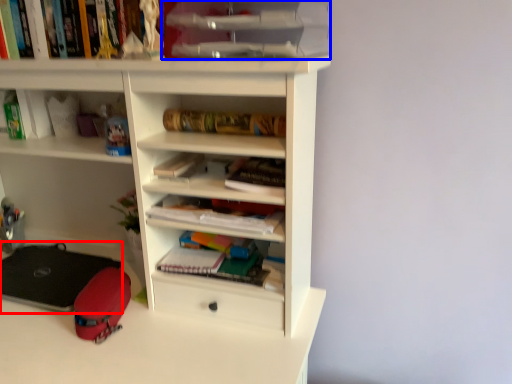
Question: Which of the following is the closest to the observer, equipment (highlighted by a red box) or cabinet (highlighted by a blue box)?

Choices:
 (A) equipment
 (B) cabinet

Answer: (B)